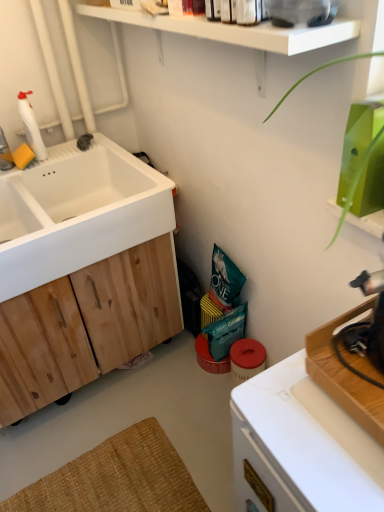
Question: Considering the positions of natural wood cabinet at left and white plastic countertop at lower right in the image, is natural wood cabinet at left wider or thinner than white plastic countertop at lower right?

Choices:
 (A) wide
 (B) thin

Answer: (A)

Question: From a real-world perspective, relative to white plastic countertop at lower right, is natural wood cabinet at left vertically above or below?

Choices:
 (A) below
 (B) above

Answer: (A)

Question: Considering the real-world distances, which object is farthest from the white plastic bottle at upper left?

Choices:
 (A) white matte sink at left
 (B) white glossy faucet at left
 (C) natural wood cabinet at left
 (D) white plastic countertop at lower right

Answer: (D)

Question: Which is farther from the white glossy faucet at left?

Choices:
 (A) white plastic countertop at lower right
 (B) white plastic bottle at upper left
 (C) white matte sink at left
 (D) natural wood cabinet at left

Answer: (A)